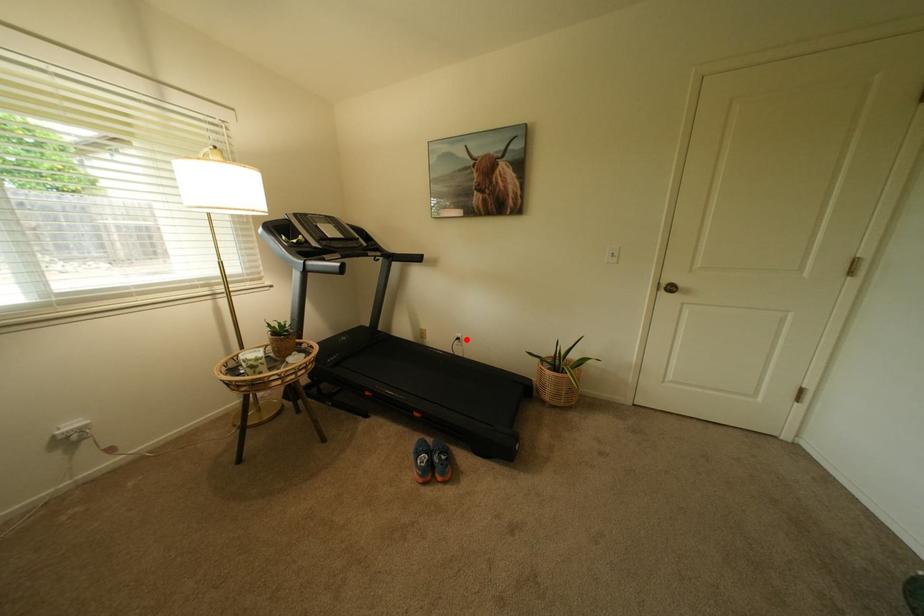
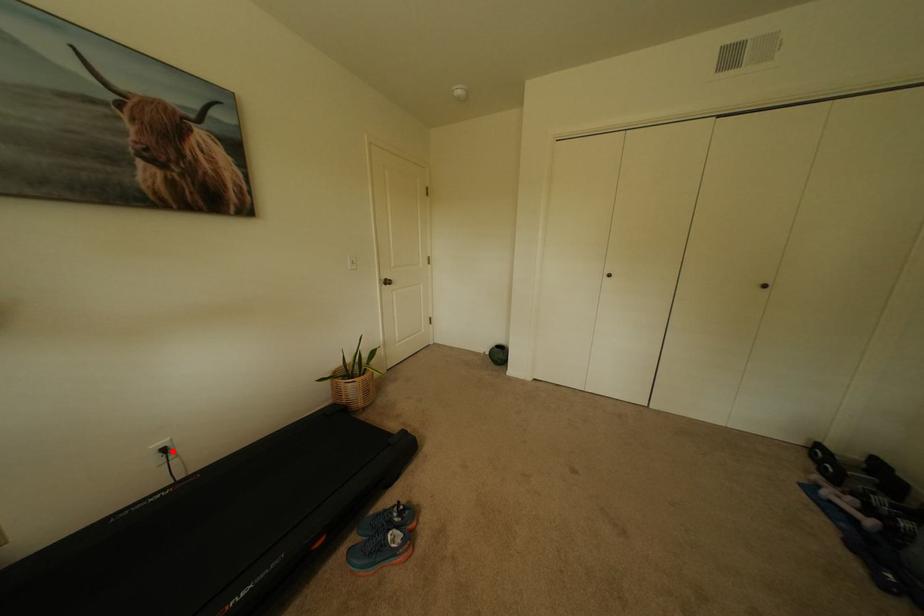
I am providing you with two images of the same scene from different viewpoints. A red point is marked on the first image and another point is marked on the second image. Does the point marked in image1 correspond to the same location as the one in image2?

Yes